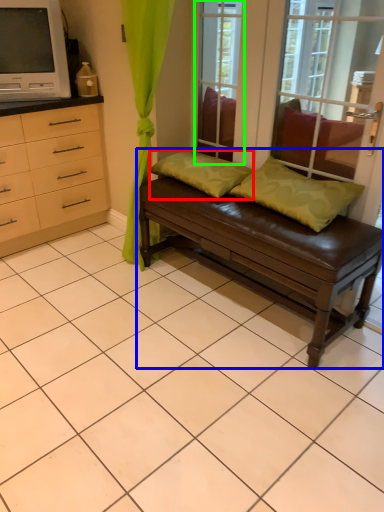
Question: Which object is the farthest from pillow (highlighted by a red box)? Choose among these: studio couch (highlighted by a blue box) or window screen (highlighted by a green box).

Choices:
 (A) studio couch
 (B) window screen

Answer: (B)